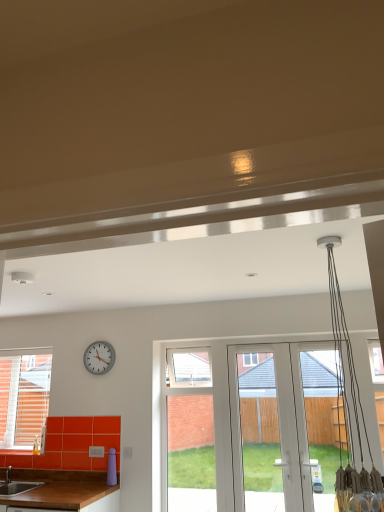
Question: Is matte brown sink at lower left inside white glossy screen door at center?

Choices:
 (A) no
 (B) yes

Answer: (A)

Question: From a real-world perspective, is white glossy screen door at center over matte brown sink at lower left?

Choices:
 (A) yes
 (B) no

Answer: (A)

Question: Considering the relative sizes of white glossy screen door at center and matte brown sink at lower left in the image provided, is white glossy screen door at center bigger than matte brown sink at lower left?

Choices:
 (A) yes
 (B) no

Answer: (B)

Question: Does white glossy screen door at center appear on the right side of matte brown sink at lower left?

Choices:
 (A) no
 (B) yes

Answer: (B)

Question: Can you confirm if white glossy screen door at center is shorter than matte brown sink at lower left?

Choices:
 (A) no
 (B) yes

Answer: (A)

Question: From the image's perspective, relative to brown wooden countertop at lower left, is matte brown sink at lower left above or below?

Choices:
 (A) below
 (B) above

Answer: (B)

Question: Visually, is matte brown sink at lower left positioned to the left or to the right of brown wooden countertop at lower left?

Choices:
 (A) left
 (B) right

Answer: (A)

Question: Do you think matte brown sink at lower left is within brown wooden countertop at lower left, or outside of it?

Choices:
 (A) outside
 (B) inside

Answer: (A)

Question: Considering the positions of matte brown sink at lower left and brown wooden countertop at lower left in the image, is matte brown sink at lower left wider or thinner than brown wooden countertop at lower left?

Choices:
 (A) wide
 (B) thin

Answer: (B)

Question: Is brown wooden countertop at lower left inside the boundaries of matte brown sink at lower left, or outside?

Choices:
 (A) inside
 (B) outside

Answer: (B)

Question: Considering the positions of brown wooden countertop at lower left and matte brown sink at lower left in the image, is brown wooden countertop at lower left taller or shorter than matte brown sink at lower left?

Choices:
 (A) tall
 (B) short

Answer: (A)

Question: Relative to matte brown sink at lower left, is brown wooden countertop at lower left in front or behind?

Choices:
 (A) front
 (B) behind

Answer: (A)

Question: From a real-world perspective, is brown wooden countertop at lower left physically located above or below matte brown sink at lower left?

Choices:
 (A) below
 (B) above

Answer: (A)

Question: From the image's perspective, is matte brown sink at lower left positioned above or below white plastic clock at upper left?

Choices:
 (A) above
 (B) below

Answer: (B)

Question: From a real-world perspective, is matte brown sink at lower left above or below white plastic clock at upper left?

Choices:
 (A) above
 (B) below

Answer: (B)